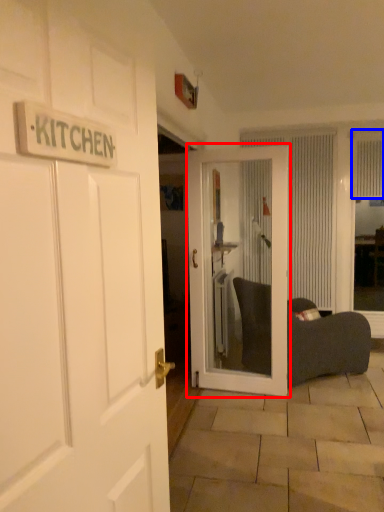
Question: Which object is further to the camera taking this photo, door (highlighted by a red box) or curtain (highlighted by a blue box)?

Choices:
 (A) door
 (B) curtain

Answer: (B)